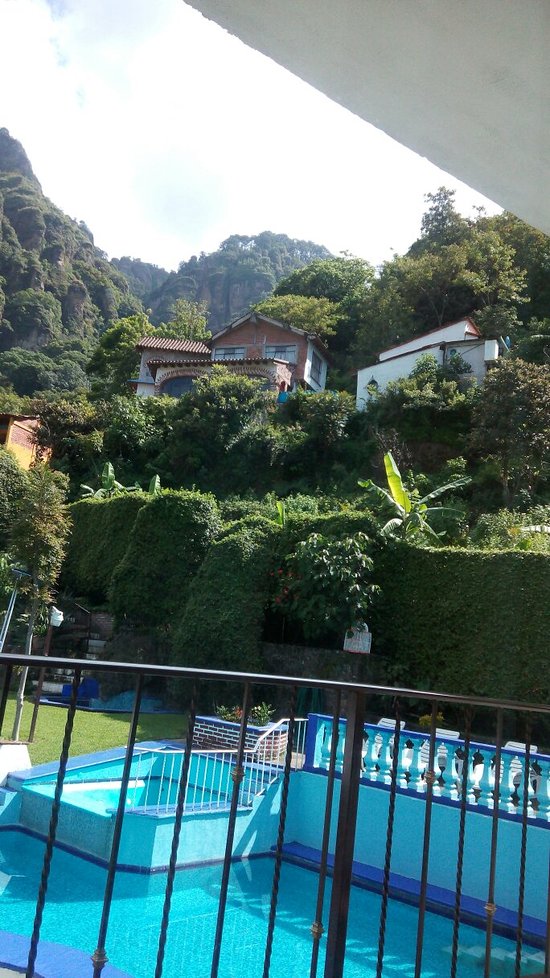
Where is `window`? The height and width of the screenshot is (978, 550). window is located at coordinates (232, 352), (275, 352), (316, 366), (370, 386).